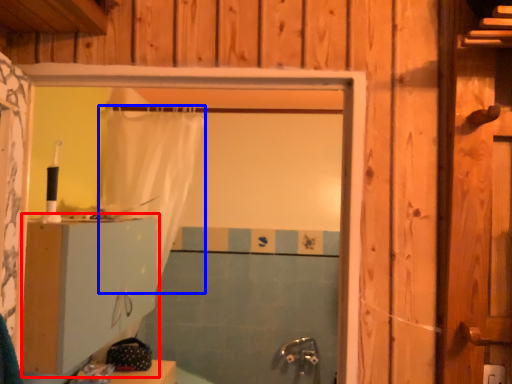
Question: Among these objects, which one is farthest to the camera, dresser (highlighted by a red box) or shower curtain (highlighted by a blue box)?

Choices:
 (A) dresser
 (B) shower curtain

Answer: (B)